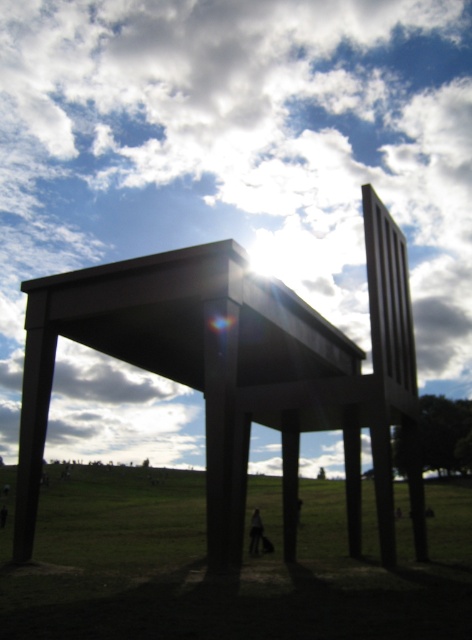
Question: Where is white fluffy cloud at upper center located in relation to green grass at lower center in the image?

Choices:
 (A) right
 (B) left

Answer: (B)

Question: Which of the following is the farthest from the observer?

Choices:
 (A) green grass at lower center
 (B) white fluffy cloud at upper center

Answer: (B)

Question: Considering the relative positions of white fluffy cloud at upper center and green grass at lower center in the image provided, where is white fluffy cloud at upper center located with respect to green grass at lower center?

Choices:
 (A) right
 (B) left

Answer: (B)

Question: Which object is closer to the camera taking this photo?

Choices:
 (A) green grass at lower center
 (B) white fluffy cloud at upper center

Answer: (A)

Question: Among these objects, which one is nearest to the camera?

Choices:
 (A) white fluffy cloud at upper center
 (B) green grass at lower center

Answer: (B)

Question: Is white fluffy cloud at upper center thinner than green grass at lower center?

Choices:
 (A) yes
 (B) no

Answer: (B)